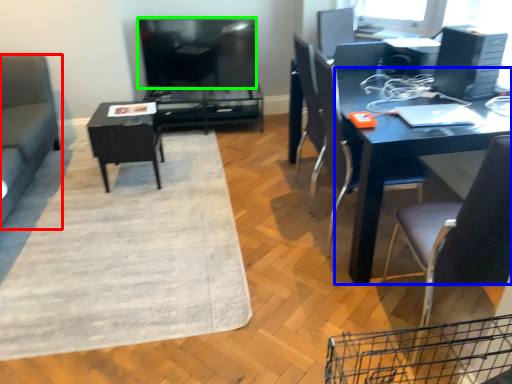
Question: Considering the real-world distances, which object is farthest from studio couch (highlighted by a red box)? desk (highlighted by a blue box) or television (highlighted by a green box)?

Choices:
 (A) desk
 (B) television

Answer: (A)